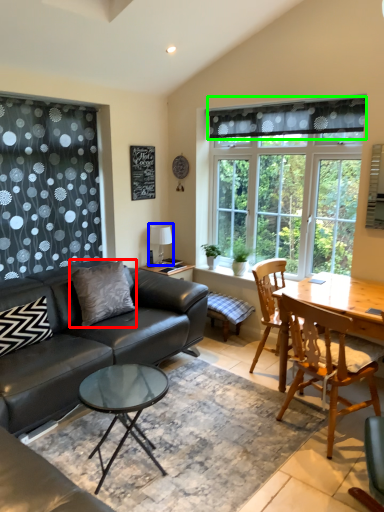
Question: Based on their relative distances, which object is farther from pillow (highlighted by a red box)? Choose from lamp (highlighted by a blue box) and curtain (highlighted by a green box).

Choices:
 (A) lamp
 (B) curtain

Answer: (B)